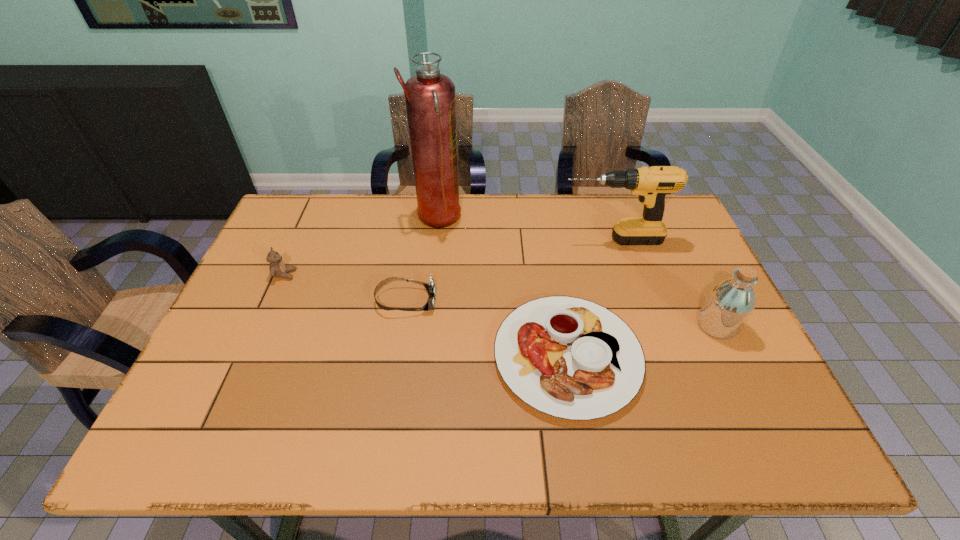
You are a GUI agent. You are given a task and a screenshot of the screen. Output one action in this format:
    pyautogui.click(x=<x>, y=<y>)
    Task: Click on the bottle located in the right edge section of the desktop
    This screenshot has width=960, height=540.
    Given the screenshot: What is the action you would take?
    pyautogui.click(x=729, y=304)

Image resolution: width=960 pixels, height=540 pixels. Find the location of `object that is at the far right corner`. object that is at the far right corner is located at coordinates (652, 184).

You are a GUI agent. You are given a task and a screenshot of the screen. Output one action in this format:
    pyautogui.click(x=<x>, y=<y>)
    Task: Click on the vacant space at the far edge of the desktop
    The image size is (960, 540).
    Given the screenshot: What is the action you would take?
    pyautogui.click(x=393, y=227)

In order to click on vacant area at the near edge of the desktop in this screenshot , I will do `click(336, 437)`.

Find the location of a particular element. The height and width of the screenshot is (540, 960). free point at the left edge is located at coordinates (236, 301).

Identify the location of free space at the right edge of the desktop. (733, 381).

I want to click on vacant space at the far left corner, so click(x=302, y=218).

Locate an element on the screen. This screenshot has height=540, width=960. free spot between the drill and the fourth nearest object is located at coordinates (448, 258).

This screenshot has height=540, width=960. In order to click on blank region between the fire extinguisher and the leftmost object in this screenshot , I will do `click(361, 247)`.

The height and width of the screenshot is (540, 960). What are the coordinates of `unoccupied position between the second shortest object and the shortest object` in the screenshot? It's located at (487, 328).